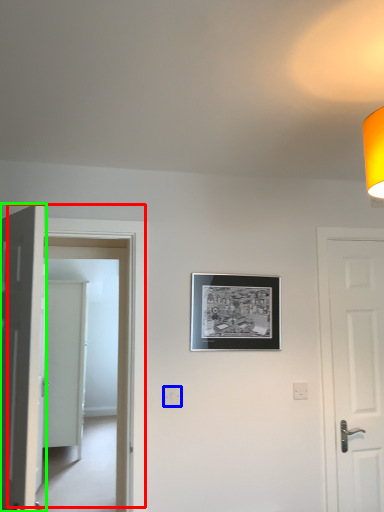
Question: Which object is the closest to the door (highlighted by a red box)? Choose among these: electric outlet (highlighted by a blue box) or door (highlighted by a green box).

Choices:
 (A) electric outlet
 (B) door

Answer: (A)